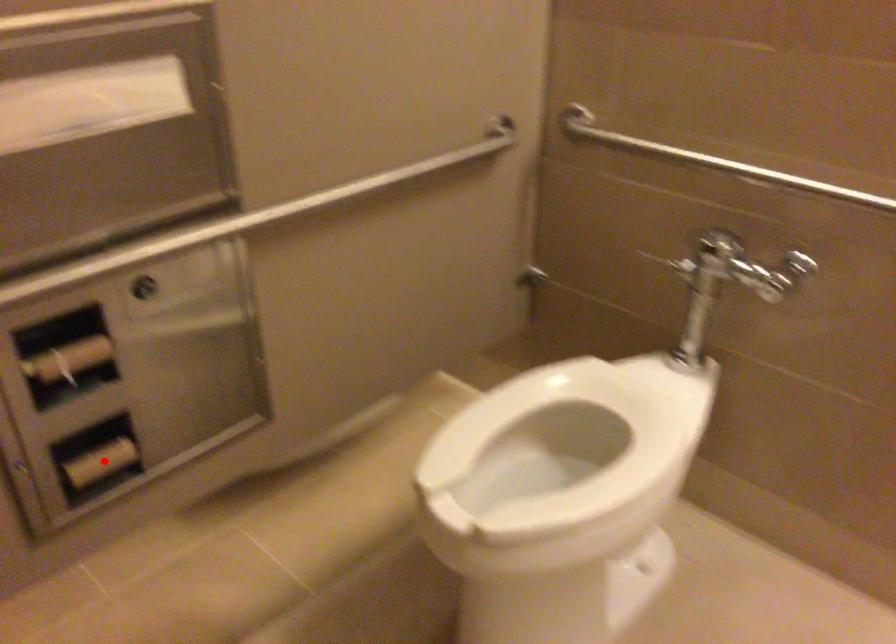
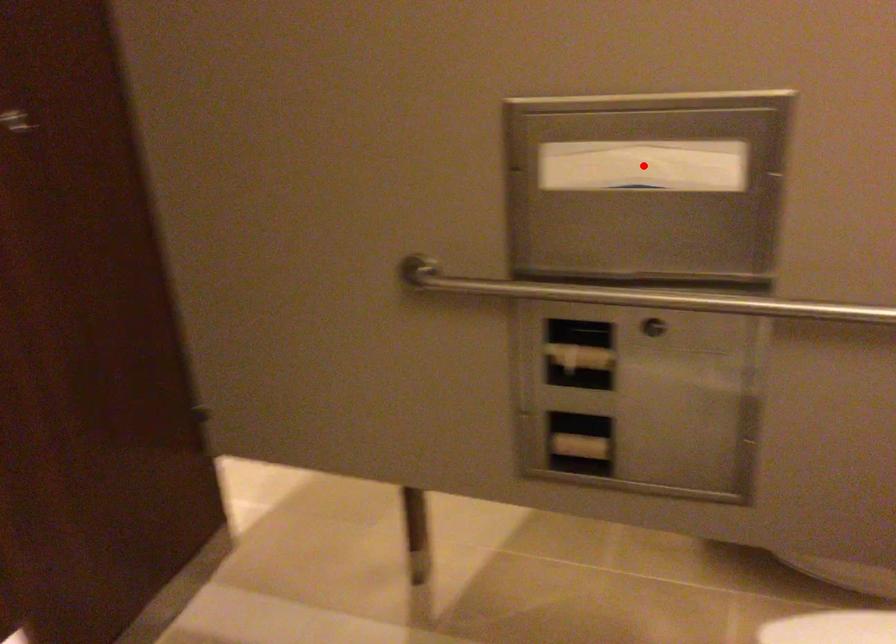
Looking at this image, I am providing you with two images of the same scene from different viewpoints. A red point is marked on the first image and another point is marked on the second image. Are the points marked in image1 and image2 representing the same 3D position?

No